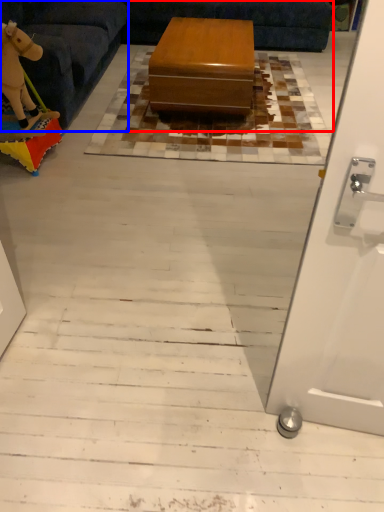
Question: Which object appears farthest to the camera in this image, couch (highlighted by a red box) or furniture (highlighted by a blue box)?

Choices:
 (A) couch
 (B) furniture

Answer: (B)